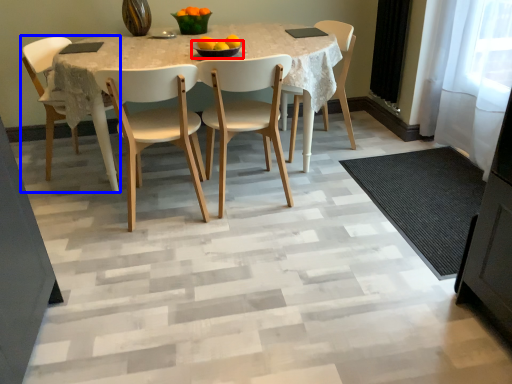
Question: Which object appears closest to the camera in this image, bowl (highlighted by a red box) or chair (highlighted by a blue box)?

Choices:
 (A) bowl
 (B) chair

Answer: (A)